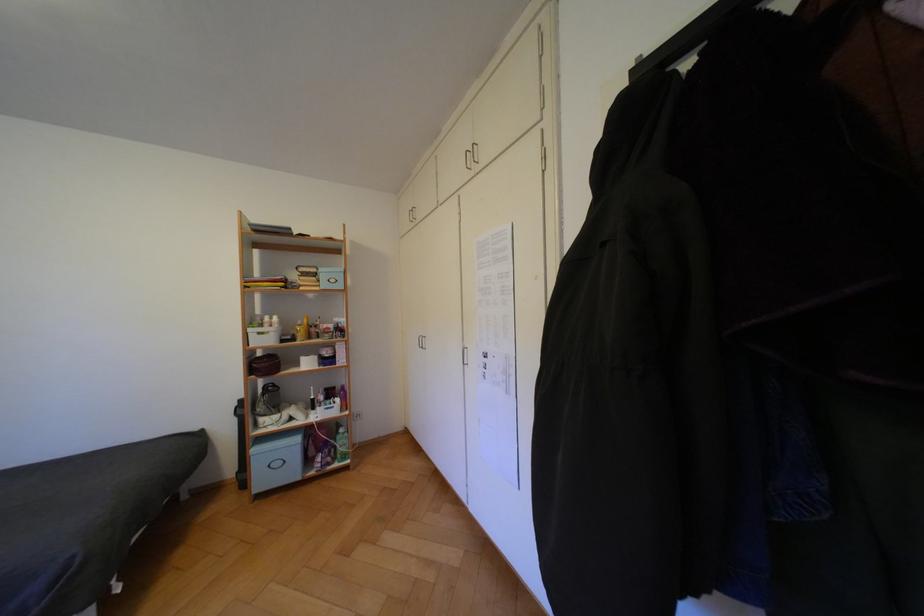
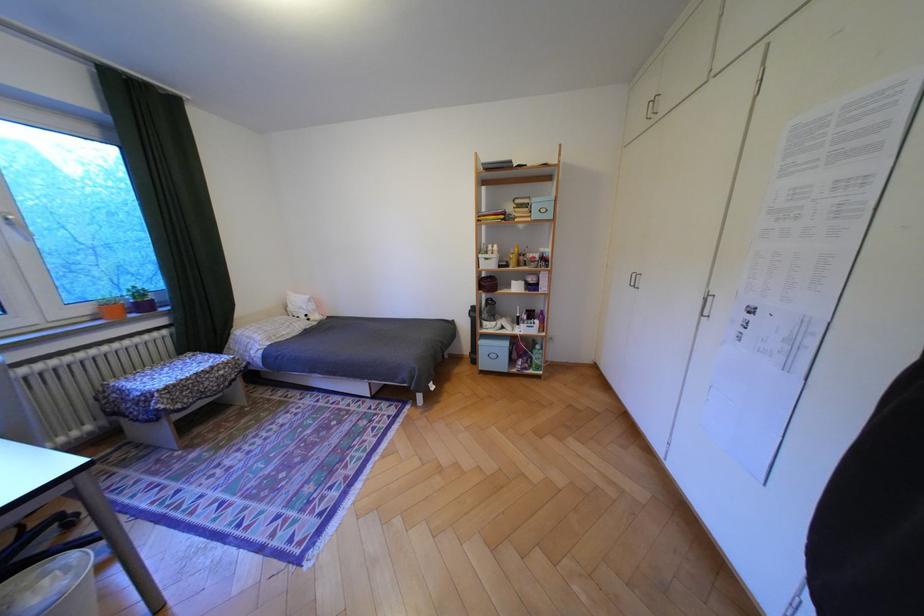
Question: I am providing you with two images of the same scene from different viewpoints. Which of the following objects are not visible in image2?

Choices:
 (A) purple bottle
 (B) orange plant pot
 (C) green bottle
 (D) none of these

Answer: (D)